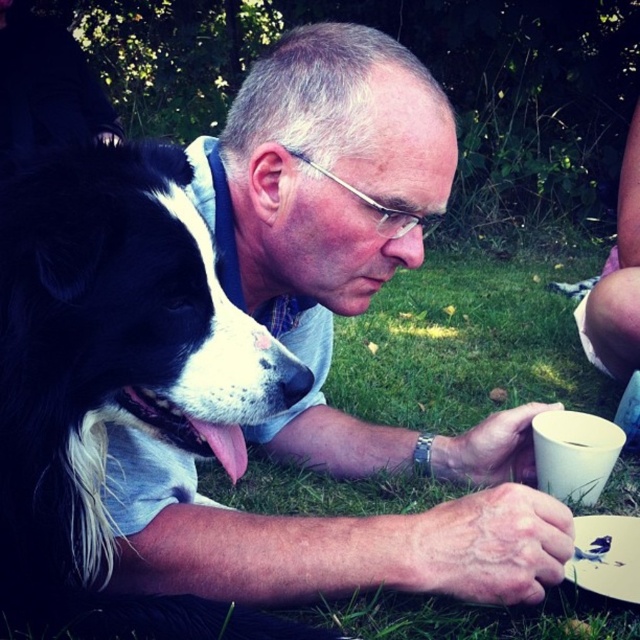
Does matte white shirt at center have a greater width compared to white matte cup at lower right?

Yes, matte white shirt at center is wider than white matte cup at lower right.

Does point (230, 252) lie in front of point (545, 442)?

Yes, it is in front of point (545, 442).

Find the location of a particular element. This screenshot has width=640, height=640. matte white shirt at center is located at coordinates (332, 348).

Is matte white shirt at center shorter than black fur dog at center?

No, matte white shirt at center is not shorter than black fur dog at center.

Is point (323, 100) farther from camera compared to point (236, 451)?

Yes, it is behind point (236, 451).

Identify the location of matte white shirt at center. This screenshot has width=640, height=640. (332, 348).

Where is `matte white shirt at center`? This screenshot has height=640, width=640. matte white shirt at center is located at coordinates (332, 348).

Can you confirm if black fur dog at center is positioned below white matte cup at lower right?

No.

Is black fur dog at center smaller than white matte cup at lower right?

Incorrect, black fur dog at center is not smaller in size than white matte cup at lower right.

Locate an element on the screen. This screenshot has height=640, width=640. black fur dog at center is located at coordinates (116, 380).